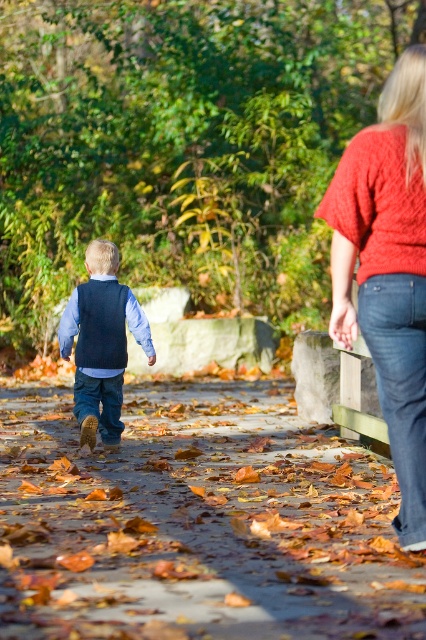
Question: Considering the real-world distances, which object is farthest from the knitted red sweater at upper right?

Choices:
 (A) denim vest at center
 (B) leaves carpeted path at center

Answer: (A)

Question: Which point is closer to the camera?

Choices:
 (A) knitted red sweater at upper right
 (B) denim vest at center
 (C) leaves carpeted path at center

Answer: (C)

Question: Does leaves carpeted path at center appear on the left side of knitted red sweater at upper right?

Choices:
 (A) no
 (B) yes

Answer: (B)

Question: Can you confirm if leaves carpeted path at center is smaller than denim vest at center?

Choices:
 (A) yes
 (B) no

Answer: (B)

Question: Can you confirm if leaves carpeted path at center is positioned to the left of knitted red sweater at upper right?

Choices:
 (A) yes
 (B) no

Answer: (A)

Question: Which of the following is the farthest from the observer?

Choices:
 (A) (75, 381)
 (B) (11, 436)

Answer: (B)